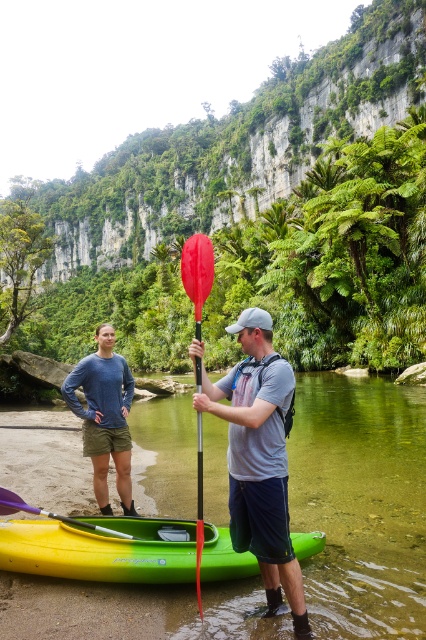
The width and height of the screenshot is (426, 640). Find the location of `green rubber kayak at lower center`. green rubber kayak at lower center is located at coordinates (360, 502).

How distant is green rubber kayak at lower center from matte yellow kayak at lower left?

green rubber kayak at lower center is 8.13 meters away from matte yellow kayak at lower left.

Who is more distant from viewer, (109,474) or (8,509)?

Positioned behind is point (109,474).

Locate an element on the screen. green rubber kayak at lower center is located at coordinates (360, 502).

Who is taller, matte black kayak at center or matte yellow kayak at lower left?

Standing taller between the two is matte black kayak at center.

Between matte black kayak at center and matte yellow kayak at lower left, which one is positioned lower?

matte yellow kayak at lower left

Find the location of `matte black kayak at center`. matte black kayak at center is located at coordinates (259, 458).

Based on the photo, does green rubber kayak at lower center appear over red matte paddle at center?

No.

What do you see at coordinates (360, 502) in the screenshot?
I see `green rubber kayak at lower center` at bounding box center [360, 502].

Based on the photo, measure the distance between green rubber kayak at lower center and camera.

green rubber kayak at lower center is 7.73 meters away from camera.

This screenshot has width=426, height=640. What are the coordinates of `green rubber kayak at lower center` in the screenshot? It's located at (360, 502).